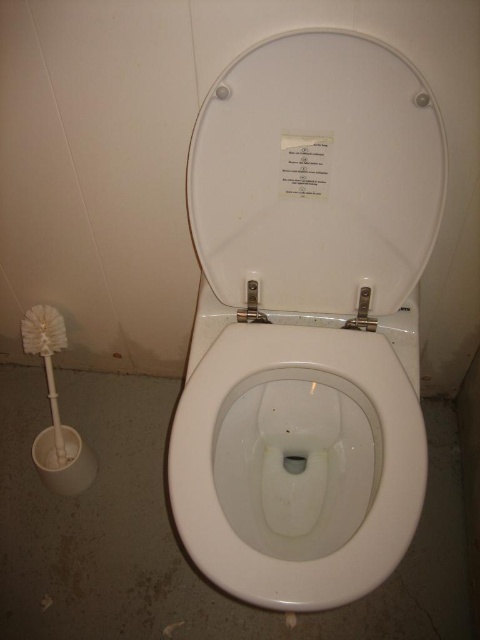
Does white glossy toilet at center have a smaller size compared to white plastic toilet paper at lower left?

No.

Can you confirm if white glossy toilet at center is positioned below white plastic toilet paper at lower left?

Actually, white glossy toilet at center is above white plastic toilet paper at lower left.

Identify the location of white glossy toilet at center. This screenshot has height=640, width=480. (307, 323).

Where is `white glossy toilet at center`? The height and width of the screenshot is (640, 480). white glossy toilet at center is located at coordinates (307, 323).

Who is more distant from viewer, (62, 428) or (310, 189)?

Positioned behind is point (62, 428).

Based on the photo, does white plastic toilet paper at lower left appear under white paper at center?

Yes.

Is point (47, 483) farther from camera compared to point (317, 173)?

That is True.

Find the location of a particular element. Image resolution: width=480 pixels, height=640 pixels. white plastic toilet paper at lower left is located at coordinates (63, 460).

Can you confirm if white glossy toilet lid at center is taller than white glossy toilet bowl at center?

No.

Does white glossy toilet lid at center have a larger size compared to white glossy toilet bowl at center?

No, white glossy toilet lid at center is not bigger than white glossy toilet bowl at center.

Identify the location of white glossy toilet lid at center. The image size is (480, 640). (328, 173).